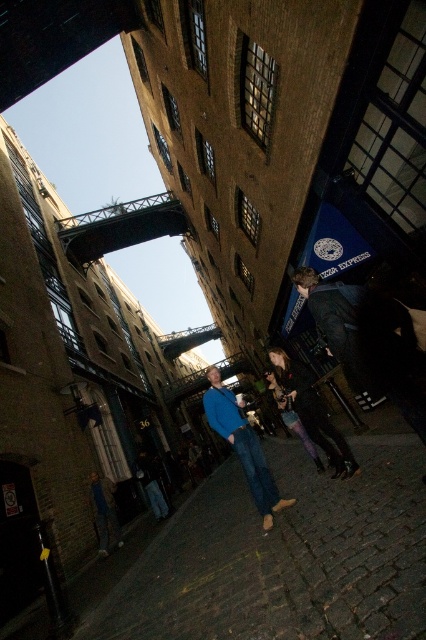
How distant is dark blue jeans at lower right from denim pants at center?

A distance of 2.55 meters exists between dark blue jeans at lower right and denim pants at center.

Is dark blue jeans at lower right in front of denim pants at center?

Yes, it is in front of denim pants at center.

Which is behind, point (314, 280) or point (285, 371)?

Positioned behind is point (285, 371).

Where is `dark blue jeans at lower right`? dark blue jeans at lower right is located at coordinates (362, 342).

I want to click on dark blue jeans at lower right, so click(362, 342).

Can you confirm if dark blue jeans at lower right is positioned to the right of matte blue sweater at center?

Indeed, dark blue jeans at lower right is positioned on the right side of matte blue sweater at center.

Does point (356, 305) come in front of point (261, 452)?

Yes, point (356, 305) is closer to viewer.

The height and width of the screenshot is (640, 426). What are the coordinates of `dark blue jeans at lower right` in the screenshot? It's located at (362, 342).

Which is below, matte blue sweater at center or denim pants at center?

matte blue sweater at center is lower down.

Can you confirm if matte blue sweater at center is shorter than denim pants at center?

No.

Locate an element on the screen. This screenshot has width=426, height=640. matte blue sweater at center is located at coordinates (242, 445).

Image resolution: width=426 pixels, height=640 pixels. What are the coordinates of `matte blue sweater at center` in the screenshot? It's located at (242, 445).